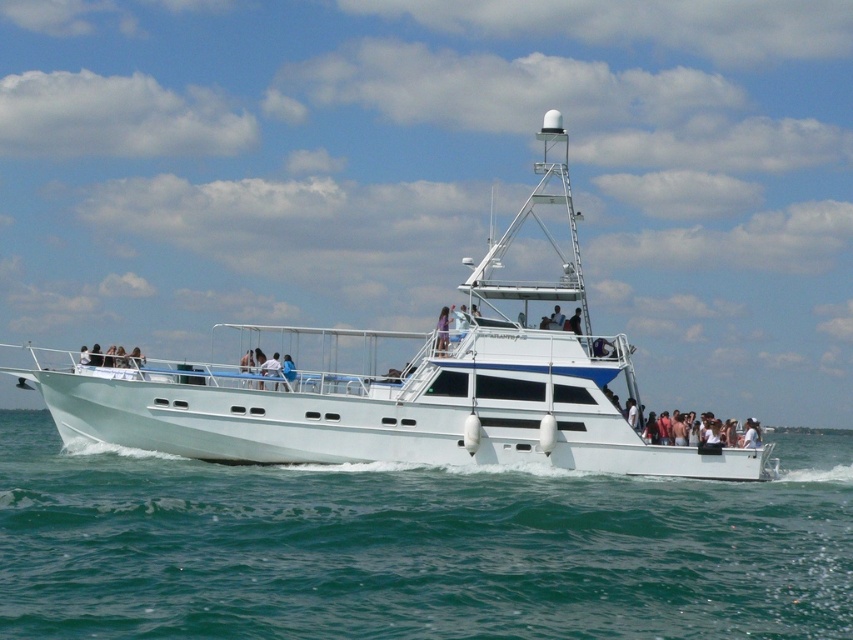
Question: Among these points, which one is nearest to the camera?

Choices:
 (A) (808, 614)
 (B) (419, 435)

Answer: (A)

Question: Which of the following is the farthest from the observer?

Choices:
 (A) matte blue shirt at center
 (B) white glossy boat at center
 (C) clear blue water at center

Answer: (A)

Question: Which of the following is the closest to the observer?

Choices:
 (A) (158, 529)
 (B) (267, 376)

Answer: (A)

Question: Does clear blue water at center have a smaller size compared to matte blue shirt at center?

Choices:
 (A) yes
 (B) no

Answer: (B)

Question: Does white glossy boat at center appear over matte blue shirt at center?

Choices:
 (A) no
 (B) yes

Answer: (B)

Question: Considering the relative positions of clear blue water at center and matte blue shirt at center in the image provided, where is clear blue water at center located with respect to matte blue shirt at center?

Choices:
 (A) below
 (B) above

Answer: (A)